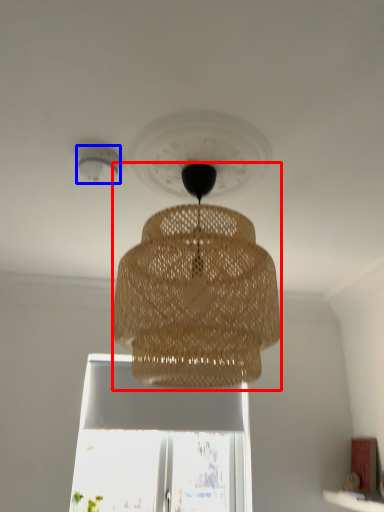
Question: Which object is closer to the camera taking this photo, lamp (highlighted by a red box) or lighting (highlighted by a blue box)?

Choices:
 (A) lamp
 (B) lighting

Answer: (A)